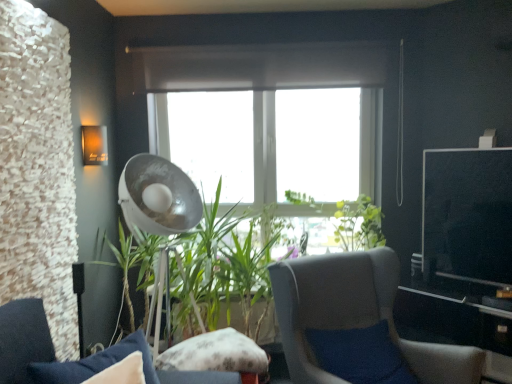
Question: Does point (224, 281) appear closer or farther from the camera than point (3, 360)?

Choices:
 (A) closer
 (B) farther

Answer: (B)

Question: Relative to velvet blue cushion at lower left, the 2th chair from the right, is green leafy plant at center in front or behind?

Choices:
 (A) behind
 (B) front

Answer: (A)

Question: Which is farther from the green leafy plant at center?

Choices:
 (A) metallic silver fan at center
 (B) velvet blue cushion at lower left, arranged as the 1th chair when viewed from the left
 (C) gray fabric chair at center, the 2th chair when ordered from left to right
 (D) matte orange wall sconce at upper left
 (E) fluffy fabric pillow at center

Answer: (D)

Question: Which object is positioned closest to the matte orange wall sconce at upper left?

Choices:
 (A) green leafy plant at center
 (B) metallic silver fan at center
 (C) gray fabric chair at center, the 2th chair when ordered from left to right
 (D) velvet blue cushion at lower left, the 2th chair from the right
 (E) fluffy fabric pillow at center

Answer: (B)